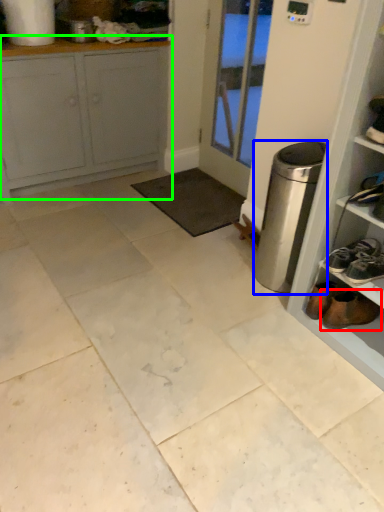
Question: Considering the real-world distances, which object is farthest from footwear (highlighted by a red box)? appliance (highlighted by a blue box) or cabinetry (highlighted by a green box)?

Choices:
 (A) appliance
 (B) cabinetry

Answer: (B)